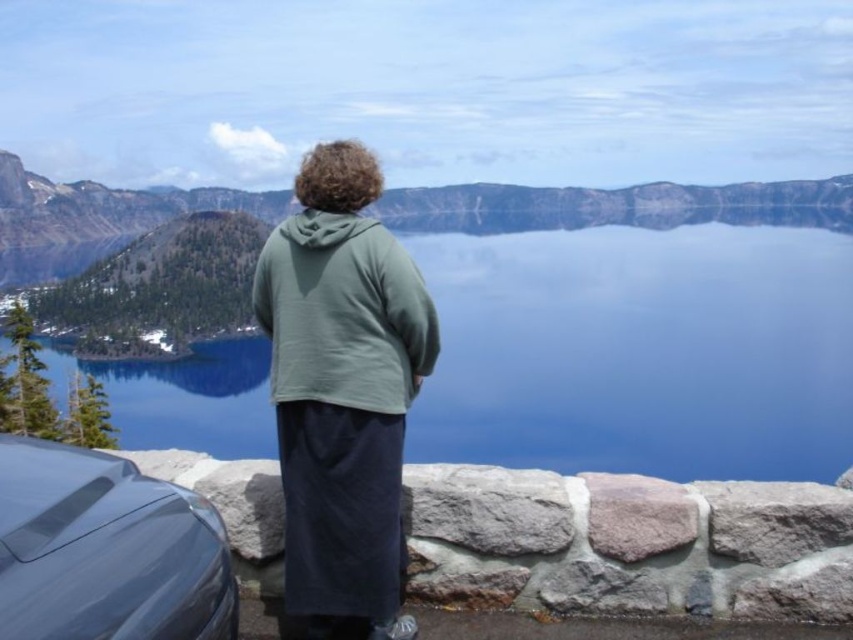
You are standing at the scenic overlook and see two points marked in the image. The first point is at coordinates point (734, 342) and the second is at point (97, 637). Which point is closer to your current position?

Point (734, 342) is further to the camera than point (97, 637), so the point closer to your current position is point (97, 637).